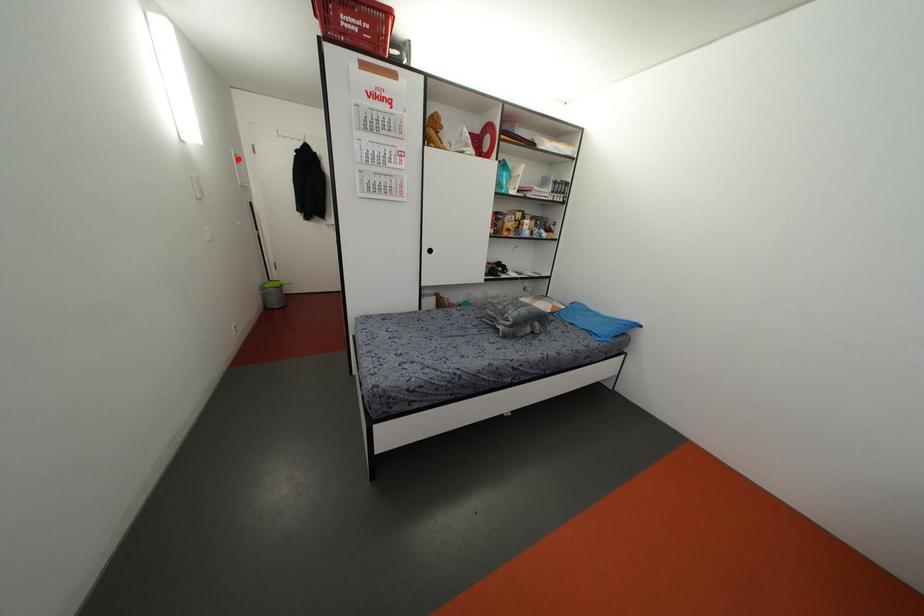
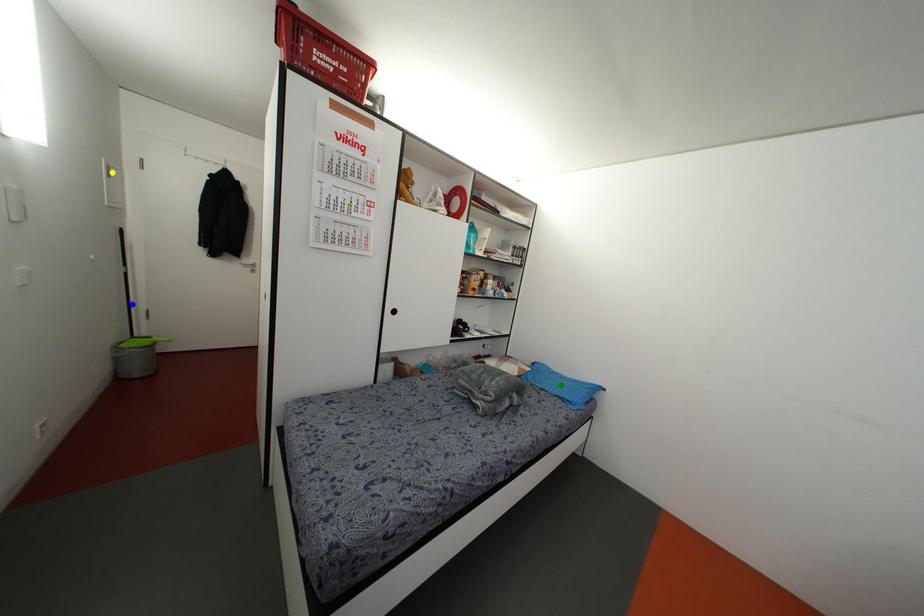
Question: I am providing you with two images of the same scene from different viewpoints. A red point is marked on the first image. You are given multiple points on the second image. Can you choose the point in image 2 that corresponds to the point in image 1?

Choices:
 (A) blue point
 (B) yellow point
 (C) green point

Answer: (B)